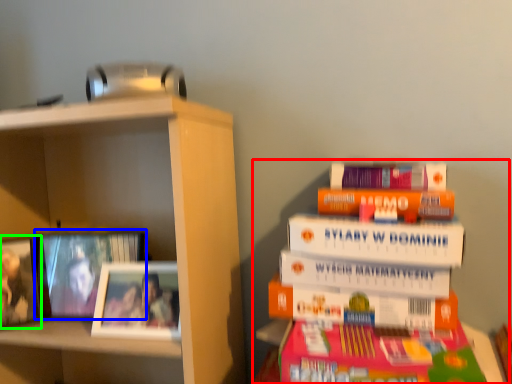
Question: Based on their relative distances, which object is nearer to book (highlighted by a red box)? Choose from picture frame (highlighted by a blue box) and picture frame (highlighted by a green box).

Choices:
 (A) picture frame
 (B) picture frame

Answer: (A)